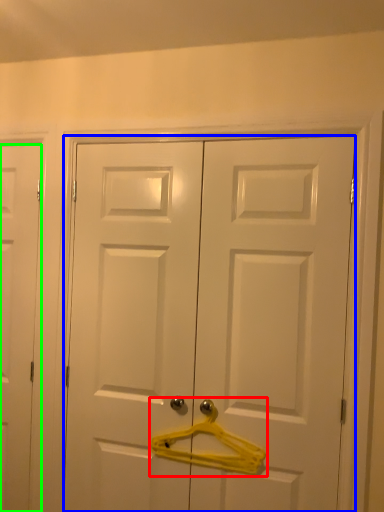
Question: Estimate the real-world distances between objects in this image. Which object is farther from hanger (highlighted by a red box), door (highlighted by a blue box) or door (highlighted by a green box)?

Choices:
 (A) door
 (B) door

Answer: (B)